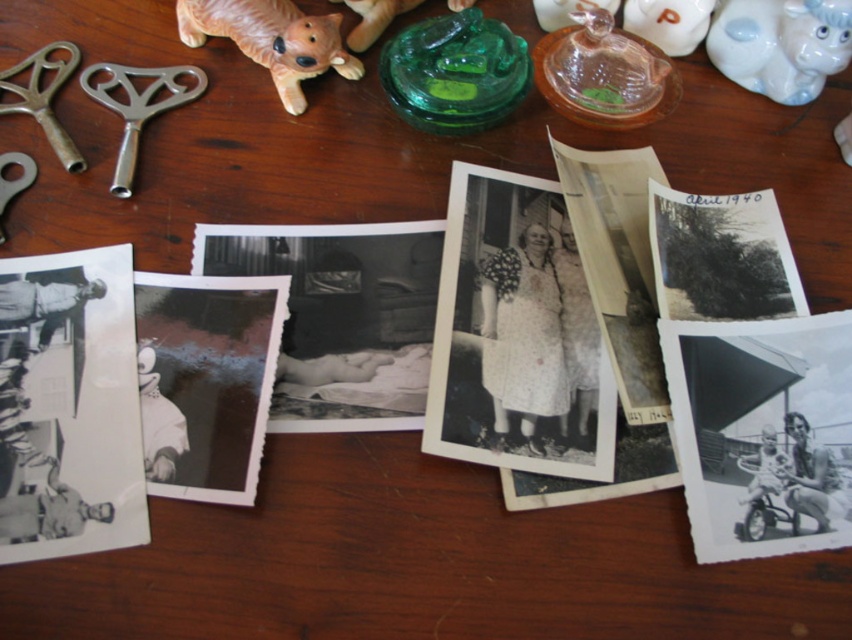
Can you confirm if white glossy ceramic toy at upper right is shorter than orange plastic dog at upper left?

Correct, white glossy ceramic toy at upper right is not as tall as orange plastic dog at upper left.

Between white glossy ceramic toy at upper right and orange plastic dog at upper left, which one appears on the right side from the viewer's perspective?

white glossy ceramic toy at upper right is more to the right.

Which is in front, point (740, 35) or point (286, 54)?

Point (286, 54) is more forward.

Locate an element on the screen. The width and height of the screenshot is (852, 640). white glossy ceramic toy at upper right is located at coordinates coord(780,44).

Based on the photo, is the position of orange plastic dog at upper left less distant than that of transparent glass figurine at upper center?

Yes.

Can you confirm if orange plastic dog at upper left is positioned to the left of transparent glass figurine at upper center?

Yes, orange plastic dog at upper left is to the left of transparent glass figurine at upper center.

Locate an element on the screen. The image size is (852, 640). orange plastic dog at upper left is located at coordinates coord(272,38).

Can you confirm if translucent glass jar at upper center is positioned to the right of transparent glass figurine at upper center?

Correct, you'll find translucent glass jar at upper center to the right of transparent glass figurine at upper center.

Can you confirm if translucent glass jar at upper center is positioned to the left of transparent glass figurine at upper center?

In fact, translucent glass jar at upper center is to the right of transparent glass figurine at upper center.

Identify the location of translucent glass jar at upper center. (668, 22).